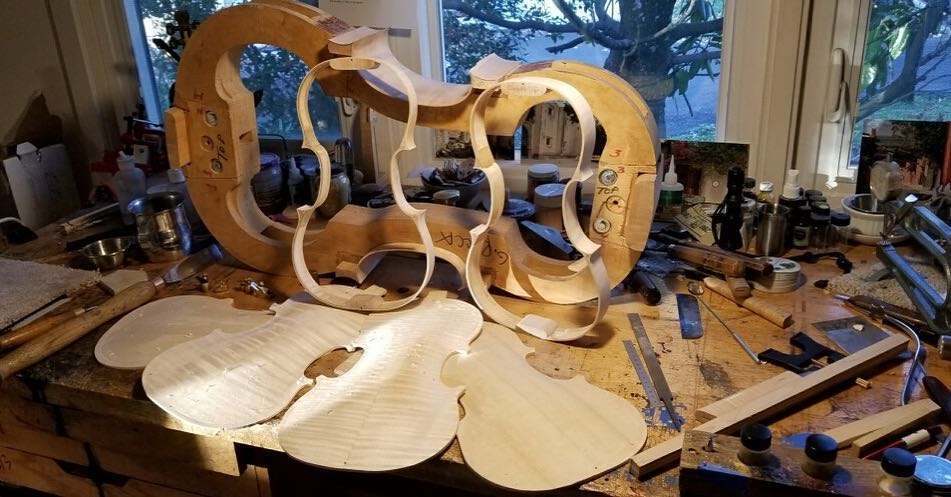
Locate an element on the screen. The image size is (951, 497). right side of window frame not in image is located at coordinates (944, 98).